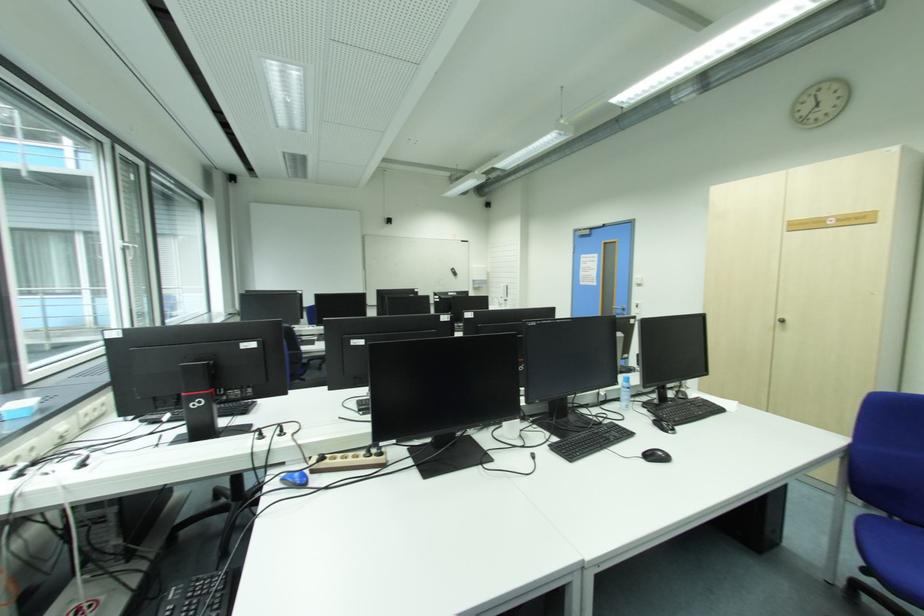
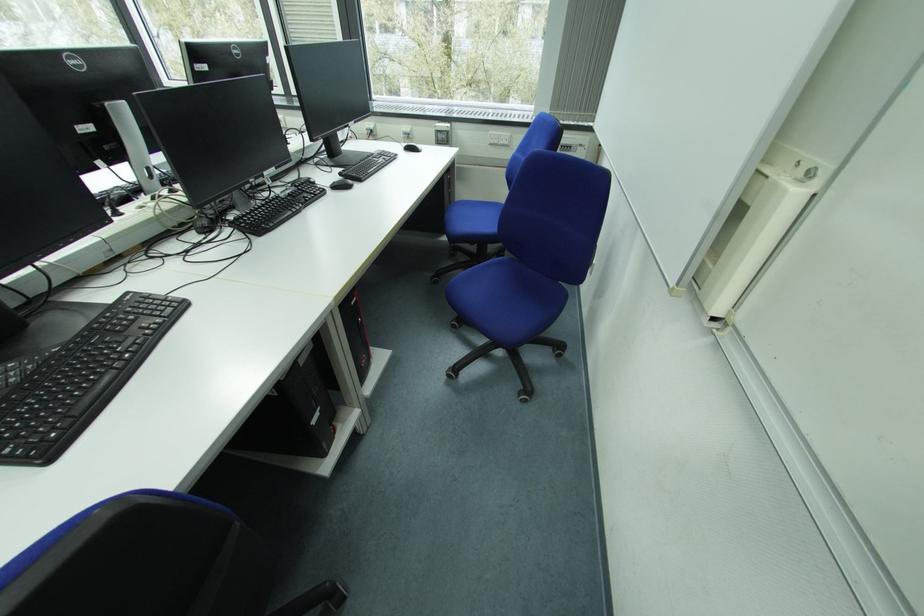
Question: I am providing you with two images of the same scene from different viewpoints. Please identify which objects are invisible in image2.

Choices:
 (A) blue chair sitting surface
 (B) black serving tray
 (C) white power switch
 (D) small blue box

Answer: (D)